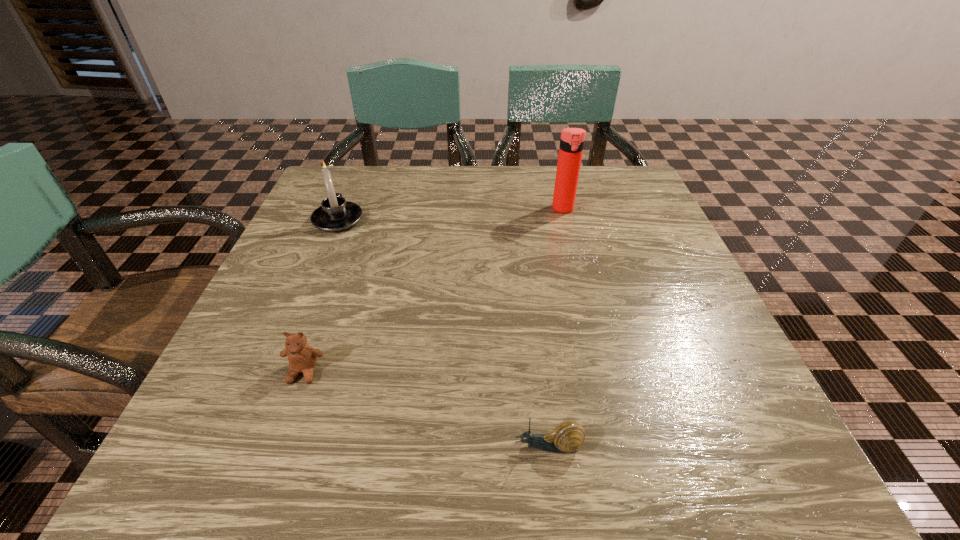
This screenshot has height=540, width=960. In order to click on vacant space located with a handle on the side of the third shortest object in this screenshot , I will do `click(349, 193)`.

Locate an element on the screen. The image size is (960, 540). free space located on the front-facing side of the nearest object is located at coordinates (339, 446).

Locate an element on the screen. The height and width of the screenshot is (540, 960). free space located 0.160m on the front-facing side of the nearest object is located at coordinates (397, 446).

Locate an element on the screen. free space located 0.100m on the front-facing side of the nearest object is located at coordinates 441,446.

Locate an element on the screen. thermos bottle that is at the far edge is located at coordinates (572, 140).

This screenshot has width=960, height=540. I want to click on candle holder that is at the far edge, so click(335, 214).

Locate an element on the screen. The height and width of the screenshot is (540, 960). object that is at the near edge is located at coordinates (568, 436).

Where is `candle holder that is at the left edge`? Image resolution: width=960 pixels, height=540 pixels. candle holder that is at the left edge is located at coordinates (335, 214).

The image size is (960, 540). Find the location of `teddy bear at the left edge`. teddy bear at the left edge is located at coordinates (302, 358).

Locate an element on the screen. This screenshot has height=540, width=960. object at the far left corner is located at coordinates (335, 214).